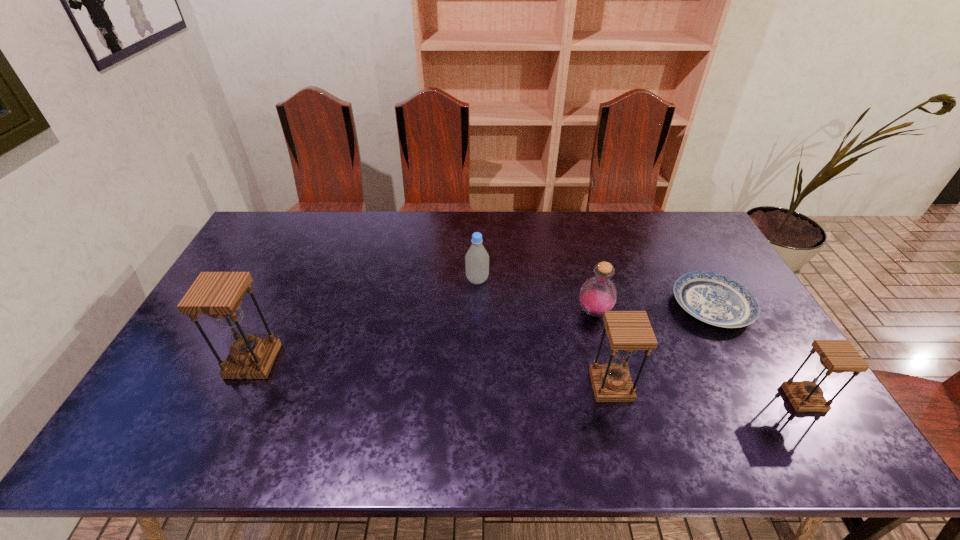
Identify the location of vacant region between the plate and the leftmost hourglass. (483, 333).

At what (x,y) coordinates should I click in order to perform the action: click on vacant area that lies between the second hourglass from left to right and the tallest hourglass. Please return your answer as a coordinate pair (x, y). Image resolution: width=960 pixels, height=540 pixels. Looking at the image, I should click on (432, 373).

Identify the location of free space between the rightmost hourglass and the shortest object. Image resolution: width=960 pixels, height=540 pixels. (757, 352).

This screenshot has height=540, width=960. In order to click on object that is the fourth closest to the second tallest object in this screenshot , I will do `click(477, 258)`.

Point out which object is positioned as the fourth nearest to the tallest hourglass. Please provide its 2D coordinates. Your answer should be formatted as a tuple, i.e. [(x, y)], where the tuple contains the x and y coordinates of a point satisfying the conditions above.

[(715, 299)]

Identify the location of hourglass that is the closest one to the leftmost hourglass. point(628,331).

Find the location of `hourglass object that ranks as the closest to the nearer bottle`. hourglass object that ranks as the closest to the nearer bottle is located at coordinates (628, 331).

The height and width of the screenshot is (540, 960). Identify the location of vacant space that satisfies the following two spatial constraints: 1. on the front side of the shortest object; 2. on the right side of the rightmost hourglass. point(762,399).

This screenshot has height=540, width=960. Identify the location of free space that satisfies the following two spatial constraints: 1. on the back side of the nearer bottle; 2. on the right side of the tallest object. click(x=276, y=312).

Identify the location of free spot that satisfies the following two spatial constraints: 1. on the back side of the right bottle; 2. on the left side of the shortest object. (592, 306).